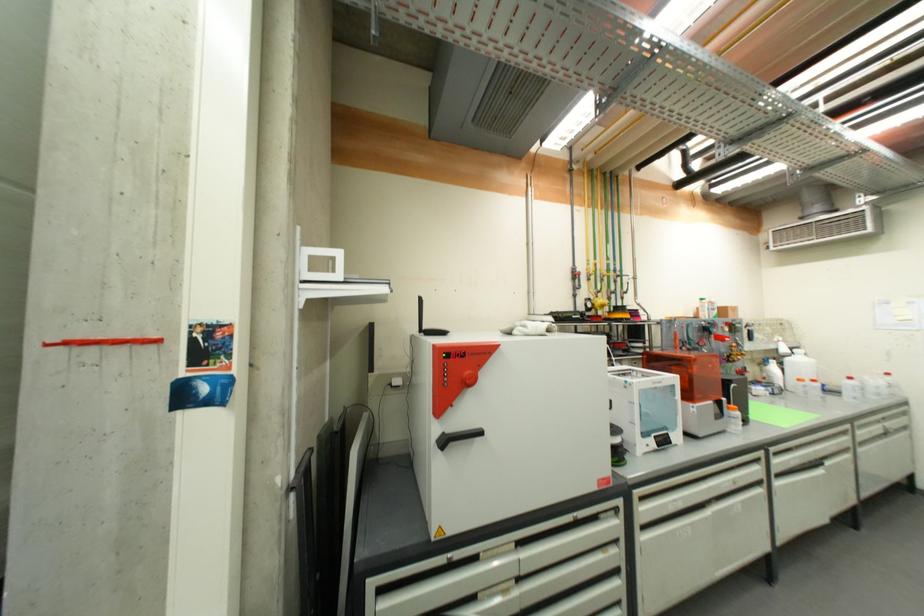
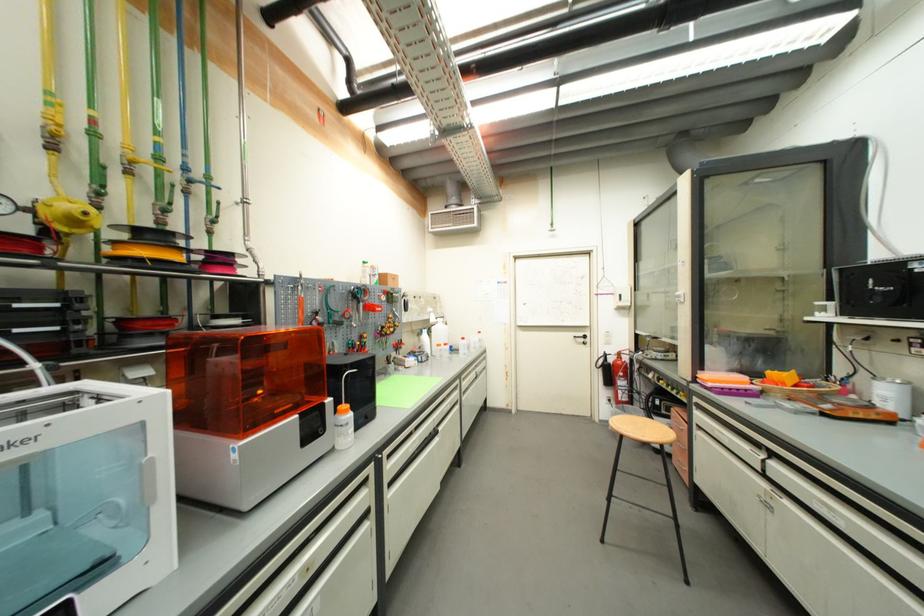
In the second image, find the point that corresponds to pixel 627 294 in the first image.

(213, 222)